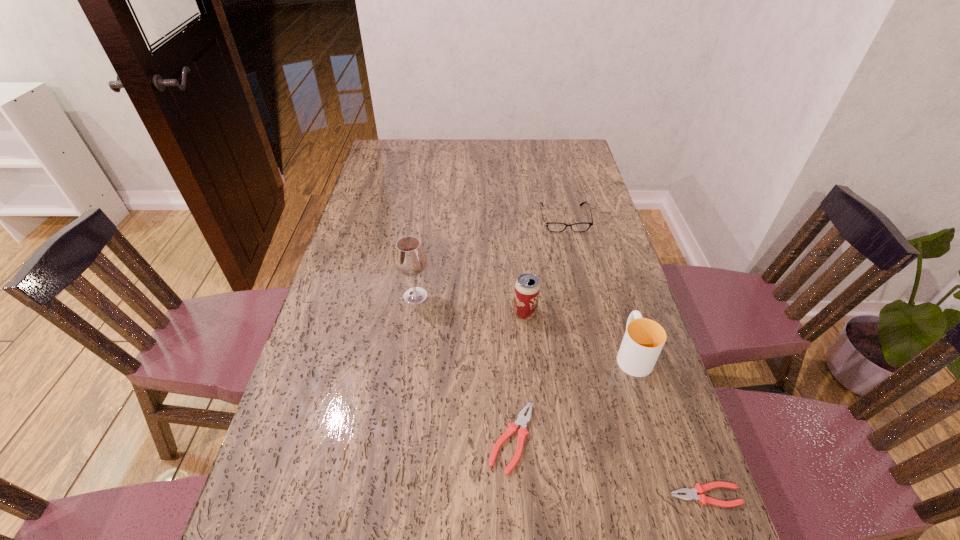
You are a GUI agent. You are given a task and a screenshot of the screen. Output one action in this format:
    pyautogui.click(x=<x>, y=<y>)
    Task: Click on the free area in between the third nearest object and the shortest object
    
    Given the screenshot: What is the action you would take?
    pyautogui.click(x=669, y=424)

Locate an element on the screen. The image size is (960, 540). vacant region between the third nearest object and the farthest object is located at coordinates (598, 286).

This screenshot has width=960, height=540. Identify the location of vacant space that's between the tallest object and the beer can. (470, 305).

Where is `blank region between the left pliers and the beer can`? This screenshot has width=960, height=540. blank region between the left pliers and the beer can is located at coordinates (518, 376).

The image size is (960, 540). Identify the location of vacant area that lies between the third nearest object and the nearer pliers. (669, 424).

Locate which object is the third closest to the shortest object. Please provide its 2D coordinates. Your answer should be formatted as a tuple, i.e. [(x, y)], where the tuple contains the x and y coordinates of a point satisfying the conditions above.

[(527, 287)]

This screenshot has height=540, width=960. Identify the location of the second closest object relative to the wineglass. (522, 420).

This screenshot has height=540, width=960. Identify the location of vacant point that satisfies the following two spatial constraints: 1. on the front side of the leftmost object; 2. on the left side of the left pliers. coord(395,438).

You are a GUI agent. You are given a task and a screenshot of the screen. Output one action in this format:
    pyautogui.click(x=<x>, y=<y>)
    Task: Click on the vacant position in the image that satisfies the following two spatial constraints: 1. on the front side of the wineglass; 2. on the left side of the second nearest object
    The height and width of the screenshot is (540, 960).
    Given the screenshot: What is the action you would take?
    pyautogui.click(x=395, y=438)